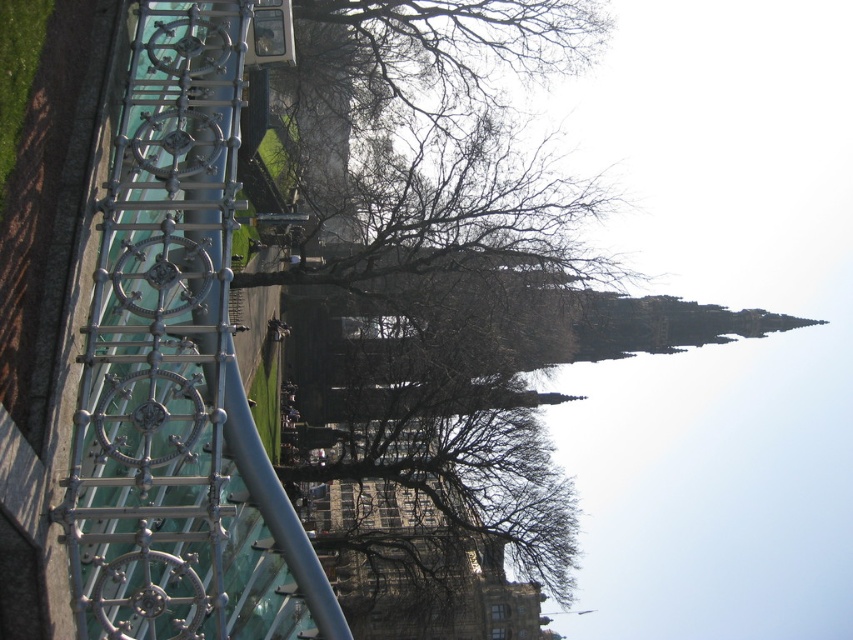
Question: Where is metallic polished rail at left located in relation to brown leafless tree at center in the image?

Choices:
 (A) below
 (B) above

Answer: (A)

Question: Which object is closer to the camera taking this photo?

Choices:
 (A) brown leafless tree at center
 (B) metallic polished rail at left

Answer: (B)

Question: Does metallic polished rail at left lie behind brown leafless tree at center?

Choices:
 (A) no
 (B) yes

Answer: (A)

Question: Which point is closer to the camera taking this photo?

Choices:
 (A) (316, 636)
 (B) (531, 212)

Answer: (A)

Question: Is the position of metallic polished rail at left more distant than that of brown leafless tree at center?

Choices:
 (A) no
 (B) yes

Answer: (A)

Question: Which point is closer to the camera?

Choices:
 (A) (540, 16)
 (B) (238, 596)

Answer: (B)